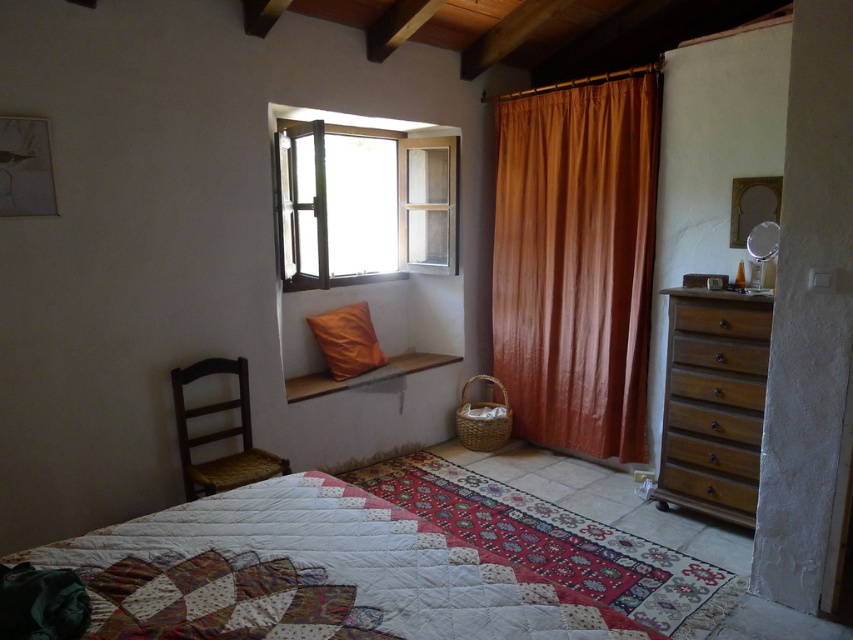
You are trying to decide whether to place a large potted plant on the windowsill where the orange leather pillow at window is currently placed. The potted plant is the same size as the wooden window at center. Based on the image, will the plant fit on the windowsill?

The wooden window at center is larger in size than the orange leather pillow at window. Since the potted plant is the same size as the wooden window at center, it will not fit on the windowsill where the orange leather pillow is placed, as the pillow is smaller and the windowsill may not accommodate the larger plant.

You are standing in the rustic bedroom and want to place a small potted plant between the wooden window at center and the brown wooden chair at left. Based on their positions, which object should the plant be closer to?

The wooden window at center is to the right of the brown wooden chair at left, so placing a small potted plant between them would require positioning it closer to the brown wooden chair at left since it is the leftmost object in this arrangement.

You are moving a 2.5 meter long ladder through the room and need to place it between the quilted fabric at lower center and the brown wooden drawer at right. Is there enough space for the ladder?

The quilted fabric at lower center is 2.11 meters from the brown wooden drawer at right. Since the ladder is 2.5 meters long, which is longer than the distance between them, there is not enough space to place the ladder between them.